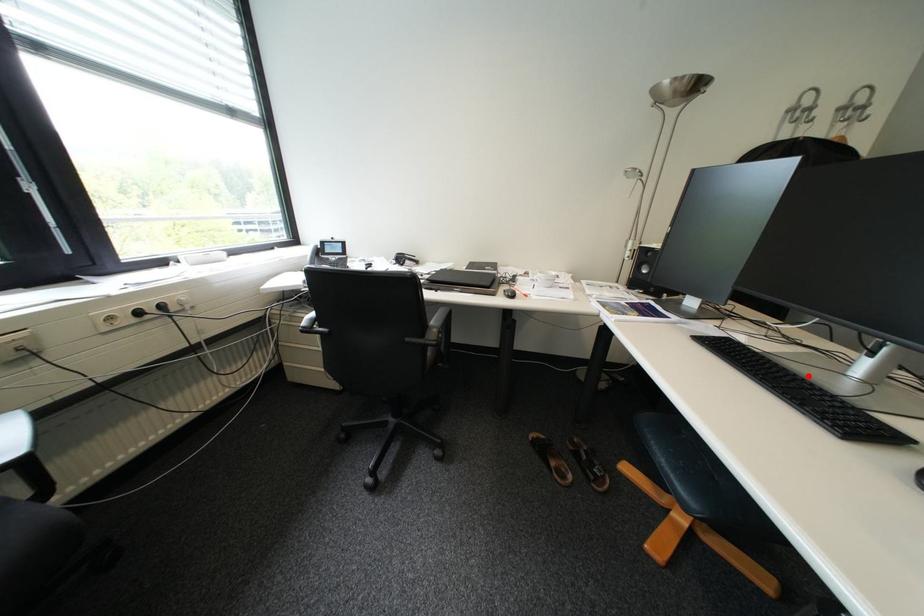
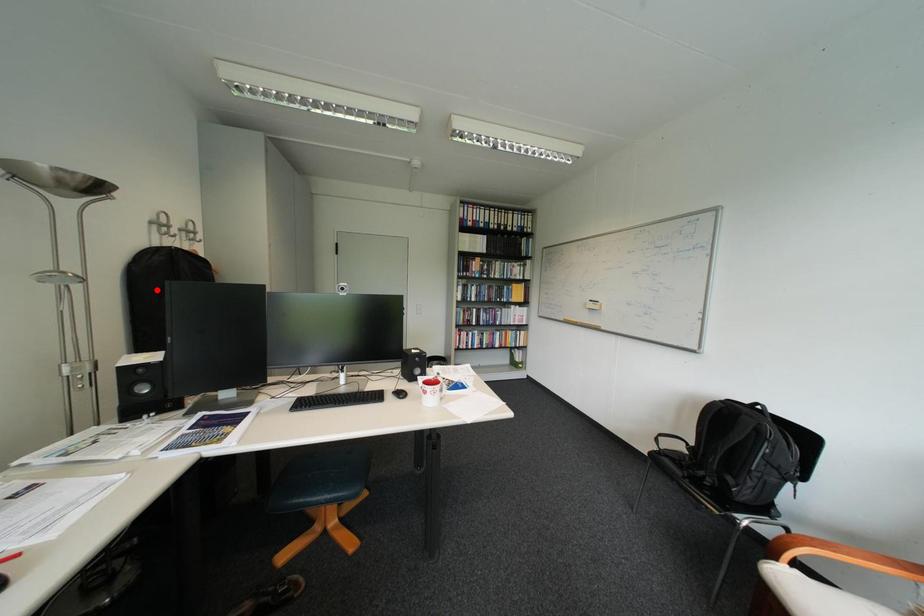
I am providing you with two images of the same scene from different viewpoints. A red point is marked on the first image and another point is marked on the second image. Is the red point in image1 aligned with the point shown in image2?

No